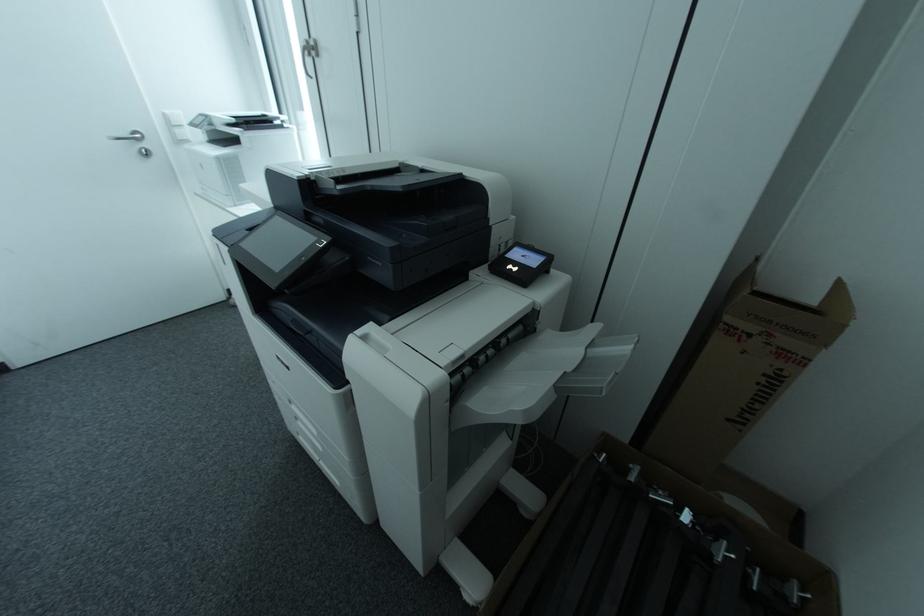
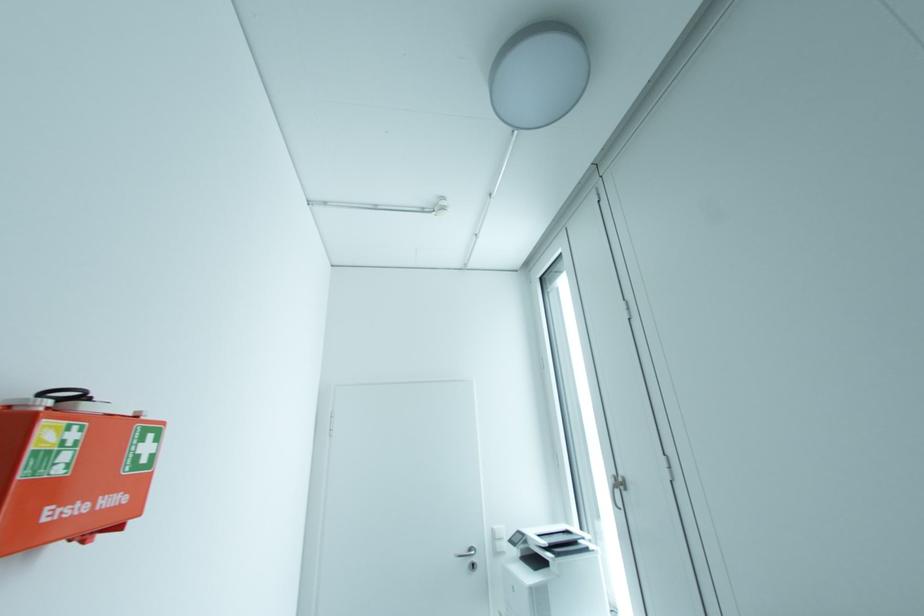
In the scene shown: Based on the continuous images, in which direction is the camera rotating?

The camera's rotation is toward left-up.